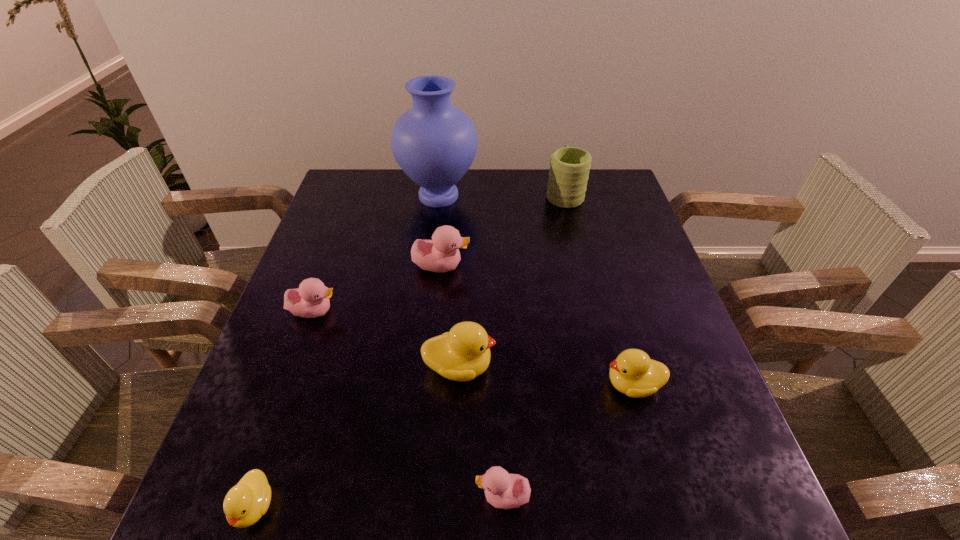
Where is `the smallest pink duckling`? This screenshot has height=540, width=960. the smallest pink duckling is located at coordinates (503, 490).

Where is `the nearest pink duckling`? This screenshot has width=960, height=540. the nearest pink duckling is located at coordinates (503, 490).

Locate an element on the screen. the leftmost yellow duckling is located at coordinates (245, 503).

Where is `the nearest yellow duckling`? The height and width of the screenshot is (540, 960). the nearest yellow duckling is located at coordinates (245, 503).

This screenshot has width=960, height=540. I want to click on free space located on the right of the tallest object, so click(x=548, y=196).

The width and height of the screenshot is (960, 540). I want to click on vacant space situated 0.300m on the front-facing side of the second pink duckling from left to right, so click(x=586, y=266).

Locate an element on the screen. The height and width of the screenshot is (540, 960). vacant space located 0.060m on the beak of the biggest yellow duckling is located at coordinates (524, 367).

Find the location of `vacant space situated on the front-facing side of the second nearest pink duckling`. vacant space situated on the front-facing side of the second nearest pink duckling is located at coordinates (370, 311).

Find the location of a particular element. The width and height of the screenshot is (960, 540). free region located on the beak of the rightmost duckling is located at coordinates (573, 384).

Locate an element on the screen. This screenshot has width=960, height=540. vacant area situated on the beak of the rightmost duckling is located at coordinates (425, 384).